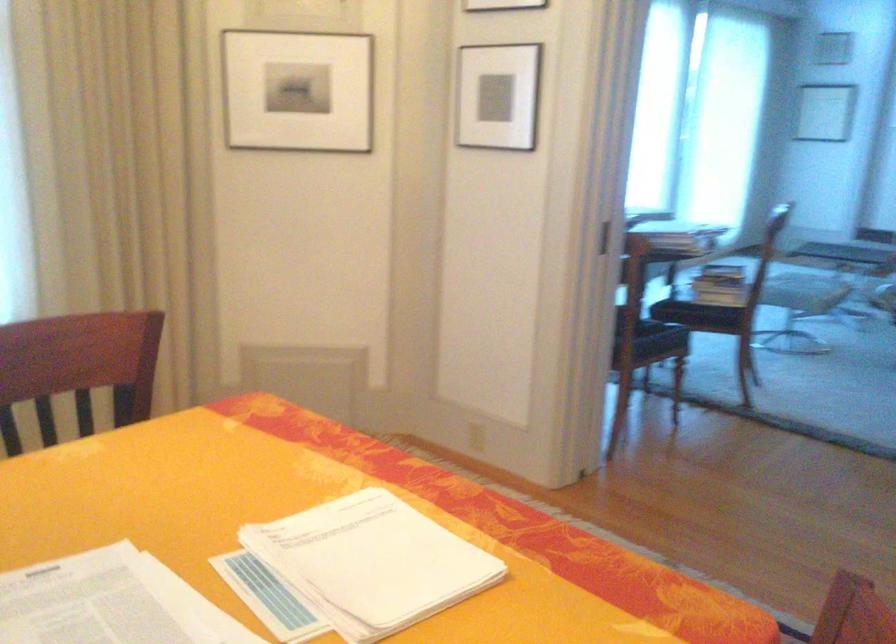
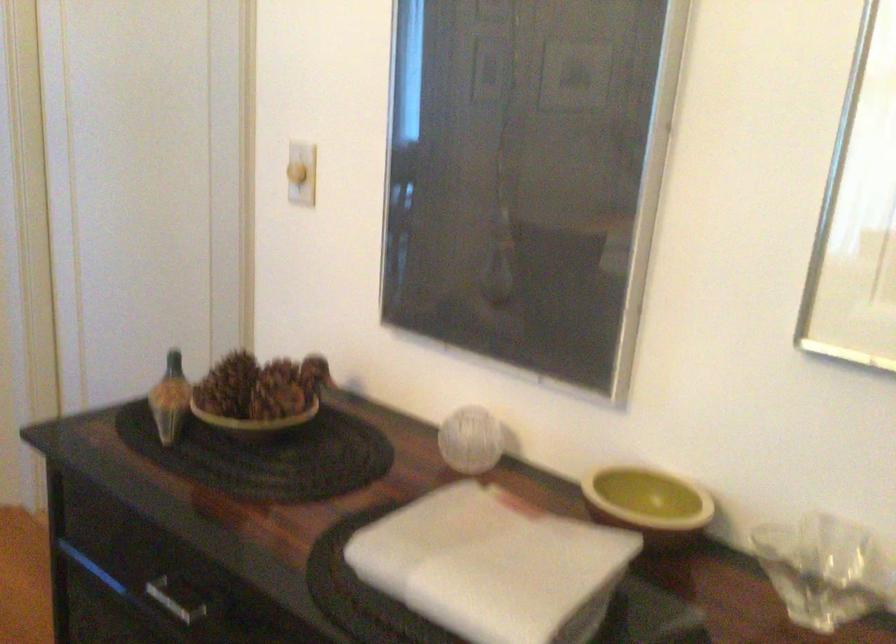
First-person continuous shooting, in which direction is the camera rotating?

The rotation direction of the camera is right-down.